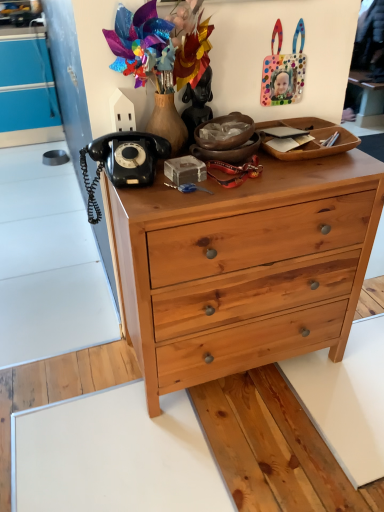
Locate an element on the screen. free spot above natural wood chest of drawers at center (from a real-world perspective) is located at coordinates (221, 172).